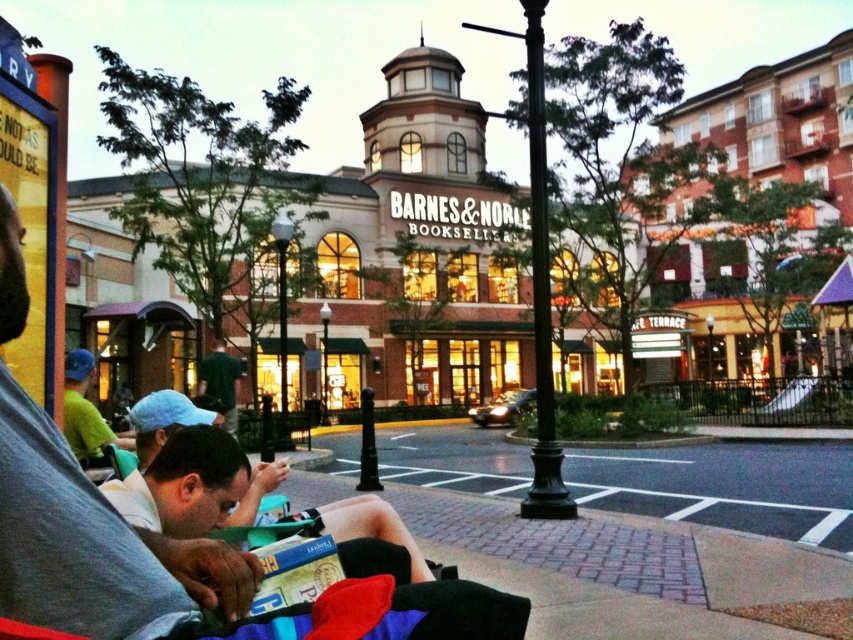
Can you confirm if gray cotton shirt at lower left is wider than dark green shirt at center?

No, gray cotton shirt at lower left is not wider than dark green shirt at center.

Is gray cotton shirt at lower left to the left of dark green shirt at center from the viewer's perspective?

No, gray cotton shirt at lower left is not to the left of dark green shirt at center.

Where is `gray cotton shirt at lower left`? gray cotton shirt at lower left is located at coordinates (82, 541).

Which is more to the right, brick building at center or dark green shirt at center?

Positioned to the right is brick building at center.

Which is above, brick building at center or dark green shirt at center?

brick building at center is above.

Does point (630, 116) come in front of point (219, 387)?

No, (630, 116) is further to viewer.

What are the coordinates of `brick building at center` in the screenshot? It's located at (422, 248).

The image size is (853, 640). What are the coordinates of `green fabric shirt at left` in the screenshot? It's located at (85, 413).

Is green fabric shirt at left to the left of dark green shirt at center from the viewer's perspective?

Indeed, green fabric shirt at left is positioned on the left side of dark green shirt at center.

Which is in front, point (80, 362) or point (234, 416)?

Point (80, 362)

The height and width of the screenshot is (640, 853). I want to click on green fabric shirt at left, so click(85, 413).